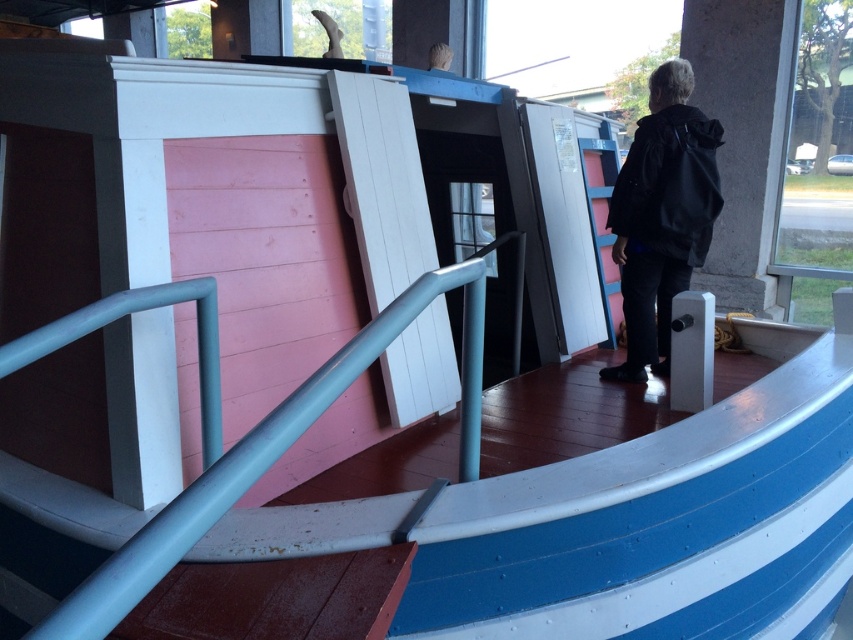
Can you confirm if gray concrete pillar at right is wider than black matte jacket at center?

Indeed, gray concrete pillar at right has a greater width compared to black matte jacket at center.

Between point (706, 76) and point (672, 205), which one is positioned in front?

Positioned in front is point (672, 205).

Describe the element at coordinates (741, 134) in the screenshot. I see `gray concrete pillar at right` at that location.

Image resolution: width=853 pixels, height=640 pixels. Identify the location of gray concrete pillar at right. (741, 134).